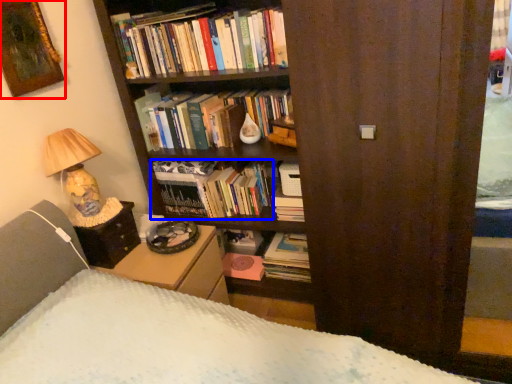
Question: Which object appears farthest to the camera in this image, picture frame (highlighted by a red box) or book (highlighted by a blue box)?

Choices:
 (A) picture frame
 (B) book

Answer: (B)